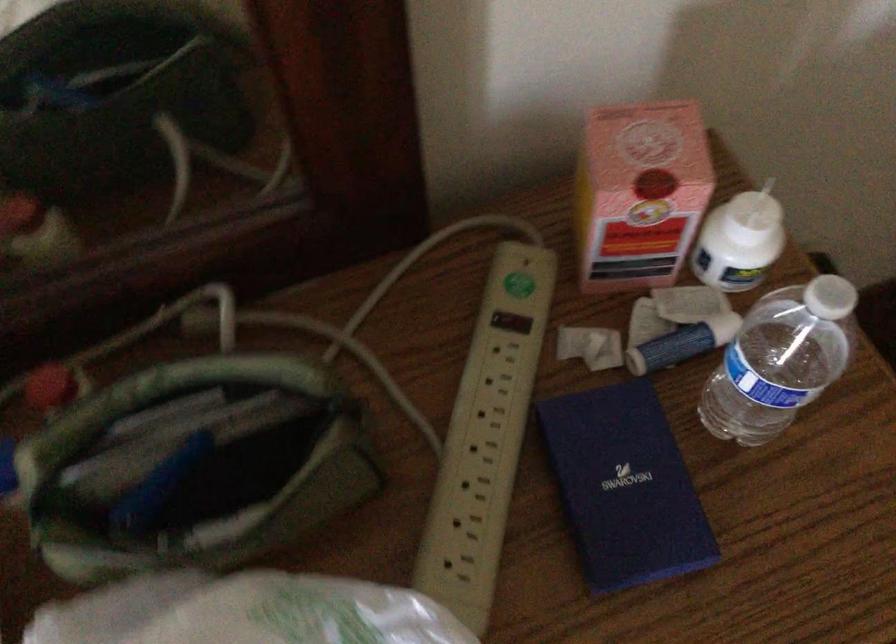
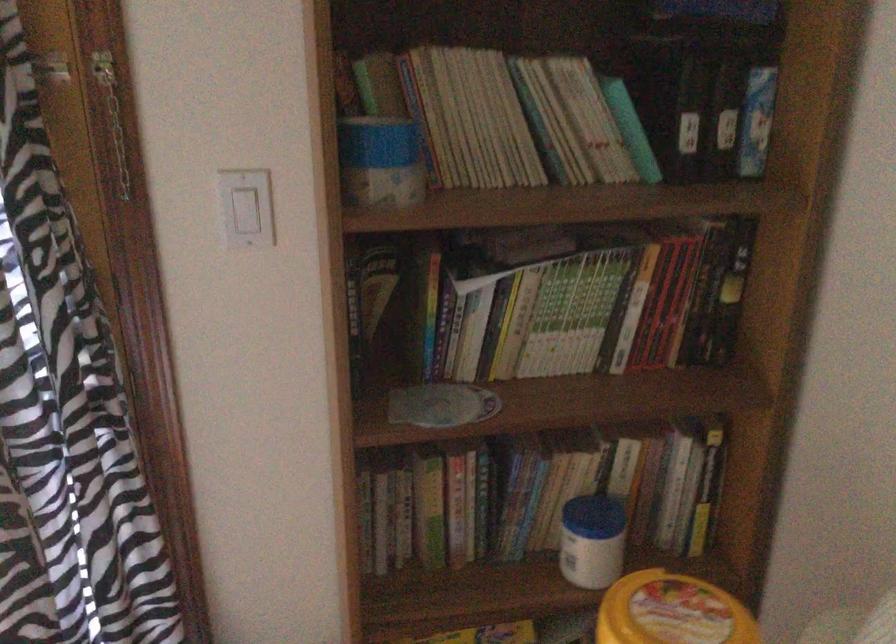
First-person continuous shooting, in which direction is the camera rotating?

The rotation direction of the camera is left-down.